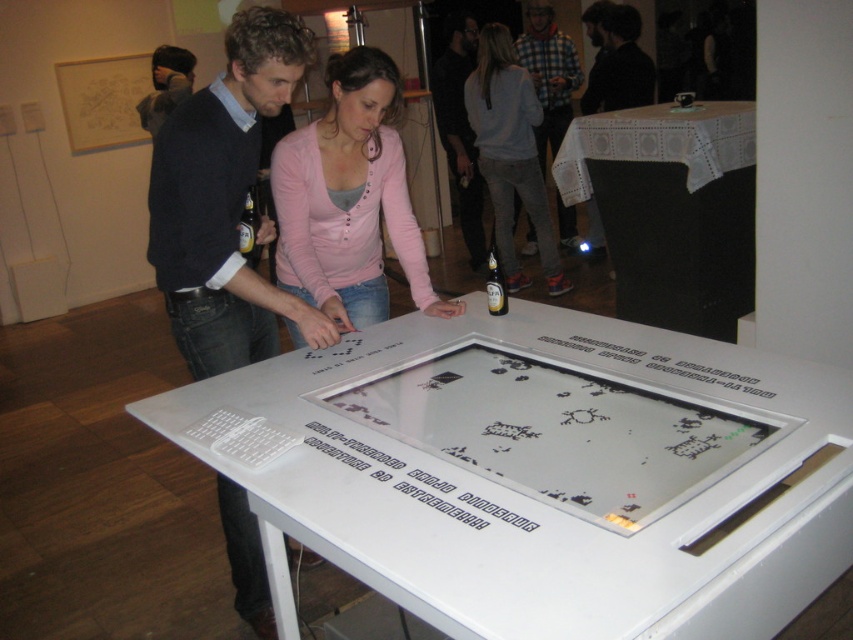
Question: Which object is the farthest from the checkered fabric shirt at upper right?

Choices:
 (A) pink button-up shirt at center
 (B) light gray sweater at center
 (C) translucent glass bottle at center
 (D) white plastic game at center

Answer: (D)

Question: Observing the image, what is the correct spatial positioning of white glossy table at center in reference to pink button-up shirt at center?

Choices:
 (A) above
 (B) below

Answer: (B)

Question: Which object appears closest to the camera in this image?

Choices:
 (A) black fabric at right
 (B) white lace tablecloth at upper right

Answer: (B)

Question: Can you confirm if white plastic game at center is positioned above light gray sweater at center?

Choices:
 (A) no
 (B) yes

Answer: (A)

Question: Does pink button-up shirt at center lie in front of clear glass bottle at center?

Choices:
 (A) no
 (B) yes

Answer: (B)

Question: Considering the real-world distances, which object is farthest from the clear glass bottle at center?

Choices:
 (A) dark gray sweater at center
 (B) white glossy table at center

Answer: (B)